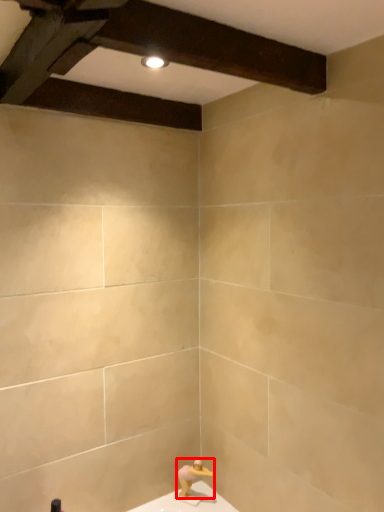
Question: From the image's perspective, what is the correct spatial relationship of person (annotated by the red box) in relation to plank?

Choices:
 (A) below
 (B) above

Answer: (A)